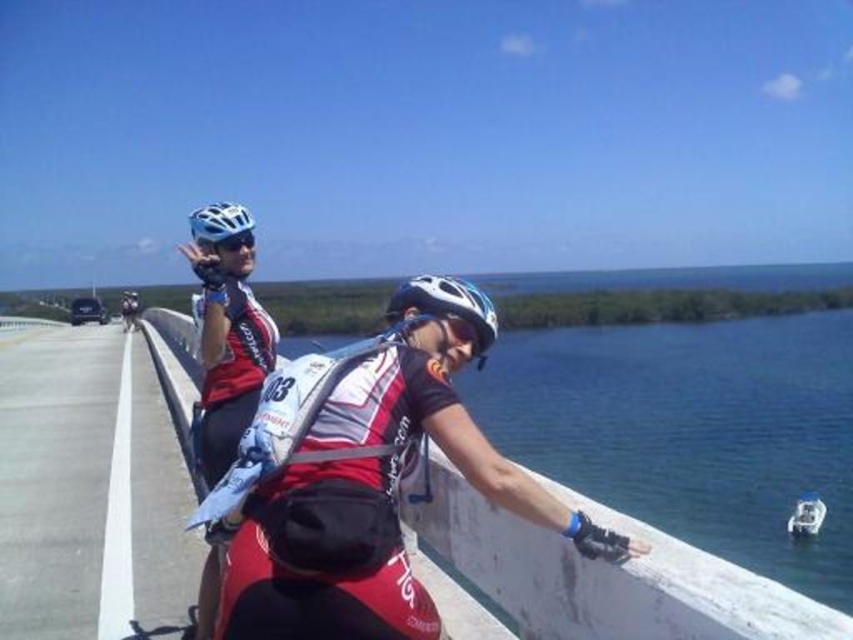
In the scene shown: You are a photographer trying to capture both cyclists in a single shot. The white matte bicycle helmet at center and the matte black helmet at upper left are both visible in your viewfinder. Which helmet should you focus on first if you want to ensure both are clearly visible in the photo?

You should focus on the matte black helmet at upper left first because it is larger, making it easier to adjust the camera settings for clarity before capturing the smaller white matte bicycle helmet at center.

You are a cyclist on the bridge and want to point out the clear blue water at center to someone behind you. Which direction should you indicate relative to the white matte bicycle helmet at upper center?

You should indicate to the left of the white matte bicycle helmet at upper center because the clear blue water at center is located to its left.

You are a photographer standing on the bridge. You want to take a photo of the concrete at left and the white matte bicycle helmet at center. Which object will appear larger in your photo?

The concrete at left will appear larger in the photo because it is much taller than the white matte bicycle helmet at center.